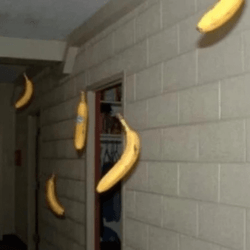
Identify the location of bag in bottom of closet. This screenshot has height=250, width=250. (113, 239).